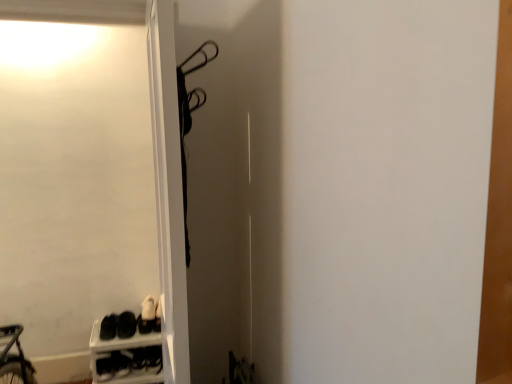
Identify the location of black matte sneakers at lower left, which is the second footwear from left to right. (126, 324).

Measure the distance between point (106,320) and camera.

2.55 meters.

What do you see at coordinates (89, 185) in the screenshot?
I see `white matte screen door at upper left` at bounding box center [89, 185].

Identify the location of black matte sneakers at lower left, arranged as the 2th footwear when viewed from the right. Image resolution: width=512 pixels, height=384 pixels. (126, 324).

Is white matte screen door at upper left inside or outside of white leather shoe at lower left?

white matte screen door at upper left is outside white leather shoe at lower left.

In terms of width, does white matte screen door at upper left look wider or thinner when compared to white leather shoe at lower left?

white matte screen door at upper left is thinner than white leather shoe at lower left.

Considering their positions, is white matte screen door at upper left located in front of or behind white leather shoe at lower left?

Clearly, white matte screen door at upper left is in front of white leather shoe at lower left.

Consider the image. Considering the sizes of objects black matte shoes at lower left, the first footwear in the left-to-right sequence, and black matte sneakers at lower left, the third footwear positioned from the left, in the image provided, who is smaller, black matte shoes at lower left, the first footwear in the left-to-right sequence, or black matte sneakers at lower left, the third footwear positioned from the left,?

black matte sneakers at lower left, the third footwear positioned from the left.

Which is closer to the camera, (111, 338) or (148, 313)?

Point (111, 338).

From the picture: How many degrees apart are the facing directions of black matte shoes at lower left, the first footwear in the left-to-right sequence, and black matte sneakers at lower left, the third footwear positioned from the left?

The angular difference between black matte shoes at lower left, the first footwear in the left-to-right sequence, and black matte sneakers at lower left, the third footwear positioned from the left, is 4.06 degrees.

From the image's perspective, which is above, black matte shoes at lower left, the first footwear in the left-to-right sequence, or black matte sneakers at lower left, which is the first footwear from right to left?

black matte shoes at lower left, the first footwear in the left-to-right sequence, appears higher in the image.

Considering the relative sizes of black matte sneakers at lower left, which is the second footwear from left to right, and white leather shoe at lower left in the image provided, is black matte sneakers at lower left, which is the second footwear from left to right, wider than white leather shoe at lower left?

Yes, black matte sneakers at lower left, which is the second footwear from left to right, is wider than white leather shoe at lower left.

Would you consider black matte sneakers at lower left, arranged as the 2th footwear when viewed from the right, to be distant from white leather shoe at lower left?

No, black matte sneakers at lower left, arranged as the 2th footwear when viewed from the right, is not far away from white leather shoe at lower left.

Would you say white leather shoe at lower left is part of black matte sneakers at lower left, arranged as the 2th footwear when viewed from the right,'s contents?

No, white leather shoe at lower left is not inside black matte sneakers at lower left, arranged as the 2th footwear when viewed from the right.

Where is `shoe directly beneath the black matte sneakers at lower left, which is the second footwear from left to right (from a real-world perspective)`? The image size is (512, 384). shoe directly beneath the black matte sneakers at lower left, which is the second footwear from left to right (from a real-world perspective) is located at coordinates (153, 358).

In the scene shown: Is white leather shoe at lower left in front of white plastic shoe rack at lower left?

That is False.

Consider the image. Considering the relative sizes of white leather shoe at lower left and white plastic shoe rack at lower left in the image provided, is white leather shoe at lower left thinner than white plastic shoe rack at lower left?

Yes.

Can you confirm if white leather shoe at lower left is bigger than white plastic shoe rack at lower left?

Actually, white leather shoe at lower left might be smaller than white plastic shoe rack at lower left.

Is white matte screen door at upper left turned away from black matte sneakers at lower left, arranged as the 2th footwear when viewed from the right?

Absolutely, white matte screen door at upper left is directed away from black matte sneakers at lower left, arranged as the 2th footwear when viewed from the right.

Considering the sizes of objects white matte screen door at upper left and black matte sneakers at lower left, which is the second footwear from left to right, in the image provided, who is thinner, white matte screen door at upper left or black matte sneakers at lower left, which is the second footwear from left to right,?

Thinner between the two is white matte screen door at upper left.

Consider the image. From a real-world perspective, who is located lower, white matte screen door at upper left or black matte sneakers at lower left, arranged as the 2th footwear when viewed from the right?

black matte sneakers at lower left, arranged as the 2th footwear when viewed from the right, from a real-world perspective.

Choose the correct answer: Is white matte screen door at upper left inside black matte sneakers at lower left, which is the second footwear from left to right, or outside it?

The correct answer is: outside.

Can you confirm if white matte screen door at upper left is positioned to the right of black matte sneakers at lower left, the third footwear positioned from the left?

In fact, white matte screen door at upper left is to the left of black matte sneakers at lower left, the third footwear positioned from the left.

Is white matte screen door at upper left positioned with its back to black matte sneakers at lower left, which is the first footwear from right to left?

Yes, white matte screen door at upper left is positioned with its back facing black matte sneakers at lower left, which is the first footwear from right to left.

Is point (129, 138) behind point (142, 315)?

Yes.

From the image's perspective, relative to black matte sneakers at lower left, the third footwear positioned from the left, is white matte screen door at upper left above or below?

Clearly, from the image's perspective, white matte screen door at upper left is above black matte sneakers at lower left, the third footwear positioned from the left.

Which of these two, white leather shoe at lower left or black matte sneakers at lower left, arranged as the 2th footwear when viewed from the right, is thinner?

With smaller width is white leather shoe at lower left.

From a real-world perspective, between white leather shoe at lower left and black matte sneakers at lower left, arranged as the 2th footwear when viewed from the right, who is vertically higher?

In real-world perspective, black matte sneakers at lower left, arranged as the 2th footwear when viewed from the right, is above.

Is white leather shoe at lower left shorter than black matte sneakers at lower left, which is the second footwear from left to right?

Yes.

You are a GUI agent. You are given a task and a screenshot of the screen. Output one action in this format:
    pyautogui.click(x=<x>, y=<y>)
    Task: Click on the 2nd footwear in front of the white leather shoe at lower left, counting from the anchor's position
    The image size is (512, 384).
    Given the screenshot: What is the action you would take?
    pyautogui.click(x=126, y=324)

At what (x,y) coordinates should I click in order to perform the action: click on shoe below the white matte screen door at upper left (from the image's perspective). Please return your answer as a coordinate pair (x, y). Image resolution: width=512 pixels, height=384 pixels. Looking at the image, I should click on (153, 358).

Starting from the black matte shoes at lower left, the 3th footwear when ordered from right to left, which footwear is the 2nd one behind? Please provide its 2D coordinates.

[(147, 316)]

Considering their positions, is white plastic shoe rack at lower left positioned closer to white matte screen door at upper left than white leather shoe at lower left?

The object closer to white matte screen door at upper left is white plastic shoe rack at lower left.

When comparing their distances from white leather shoe at lower left, does black matte sneakers at lower left, which is the second footwear from left to right, or white matte screen door at upper left seem further?

Based on the image, white matte screen door at upper left appears to be further to white leather shoe at lower left.

Estimate the real-world distances between objects in this image. Which object is further from black matte sneakers at lower left, arranged as the 2th footwear when viewed from the right, black matte sneakers at lower left, the third footwear positioned from the left, or white plastic shoe rack at lower left?

white plastic shoe rack at lower left is further to black matte sneakers at lower left, arranged as the 2th footwear when viewed from the right.

Looking at the image, which one is located closer to black matte sneakers at lower left, which is the second footwear from left to right, black matte sneakers at lower left, which is the first footwear from right to left, or white leather shoe at lower left?

black matte sneakers at lower left, which is the first footwear from right to left, lies closer to black matte sneakers at lower left, which is the second footwear from left to right, than the other object.

Looking at the image, which one is located closer to white leather shoe at lower left, black matte shoes at lower left, the 3th footwear when ordered from right to left, or white matte screen door at upper left?

Based on the image, black matte shoes at lower left, the 3th footwear when ordered from right to left, appears to be nearer to white leather shoe at lower left.

From the image, which object appears to be farther from black matte sneakers at lower left, which is the second footwear from left to right, black matte sneakers at lower left, which is the first footwear from right to left, or black matte shoes at lower left, the 3th footwear when ordered from right to left?

black matte sneakers at lower left, which is the first footwear from right to left, is further to black matte sneakers at lower left, which is the second footwear from left to right.

Which object lies nearer to the anchor point white leather shoe at lower left, white matte screen door at upper left or black matte sneakers at lower left, which is the first footwear from right to left?

Among the two, black matte sneakers at lower left, which is the first footwear from right to left, is located nearer to white leather shoe at lower left.

When comparing their distances from black matte sneakers at lower left, arranged as the 2th footwear when viewed from the right, does white plastic shoe rack at lower left or white leather shoe at lower left seem further?

white leather shoe at lower left is positioned further to the anchor black matte sneakers at lower left, arranged as the 2th footwear when viewed from the right.

What are the coordinates of `bookshelf between white matte screen door at upper left and black matte sneakers at lower left, arranged as the 2th footwear when viewed from the right, from front to back` in the screenshot? It's located at (127, 348).

At what (x,y) coordinates should I click in order to perform the action: click on bookshelf between white matte screen door at upper left and black matte sneakers at lower left, the third footwear positioned from the left, along the z-axis. Please return your answer as a coordinate pair (x, y). Looking at the image, I should click on (127, 348).

The width and height of the screenshot is (512, 384). I want to click on footwear between black matte shoes at lower left, the 3th footwear when ordered from right to left, and white leather shoe at lower left, in the vertical direction, so click(147, 316).

Where is `footwear located between white matte screen door at upper left and black matte sneakers at lower left, which is the second footwear from left to right, in the depth direction`? footwear located between white matte screen door at upper left and black matte sneakers at lower left, which is the second footwear from left to right, in the depth direction is located at coordinates (108, 327).